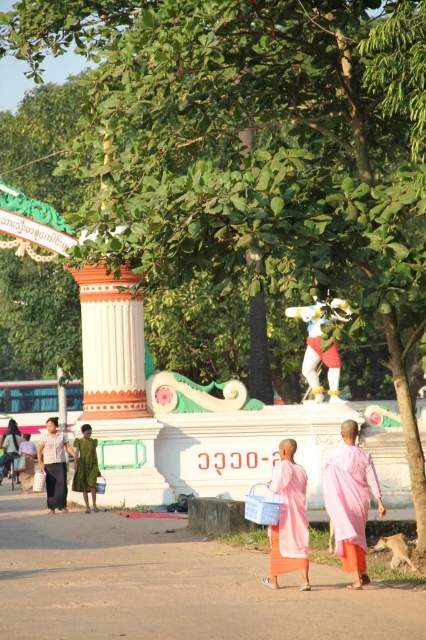
Question: Among these points, which one is farthest from the camera?

Choices:
 (A) (62, 445)
 (B) (271, 529)

Answer: (A)

Question: Is pink silk robe at lower right thinner than pink silk robe at center?

Choices:
 (A) yes
 (B) no

Answer: (B)

Question: Can you confirm if pink silk robe at center is bigger than green matte dress at center?

Choices:
 (A) yes
 (B) no

Answer: (A)

Question: Based on their relative distances, which object is nearer to the pink cotton robe at center?

Choices:
 (A) green matte dress at center
 (B) pink silk robe at lower right
 (C) pink silk robe at center

Answer: (A)

Question: From the image, what is the correct spatial relationship of pink silk robe at center in relation to pink cotton robe at center?

Choices:
 (A) left
 (B) right

Answer: (B)

Question: Which of these objects is positioned farthest from the pink cotton robe at center?

Choices:
 (A) pink silk robe at lower right
 (B) pink silk robe at center
 (C) green matte dress at center

Answer: (B)